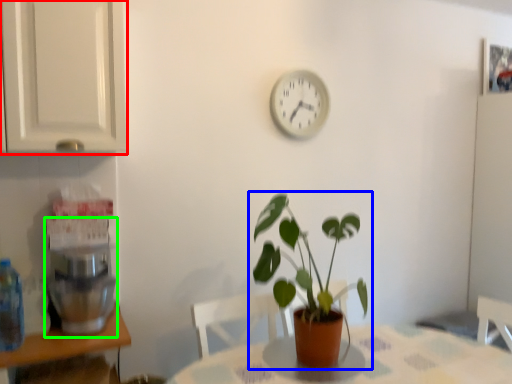
Question: Considering the real-world distances, which object is closest to cabinetry (highlighted by a red box)? houseplant (highlighted by a blue box) or coffee machine (highlighted by a green box).

Choices:
 (A) houseplant
 (B) coffee machine

Answer: (B)